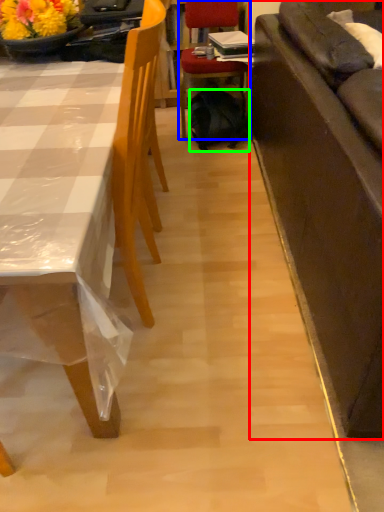
Question: Which is farther away from studio couch (highlighted by a red box)? chair (highlighted by a blue box) or backpack (highlighted by a green box)?

Choices:
 (A) chair
 (B) backpack

Answer: (A)